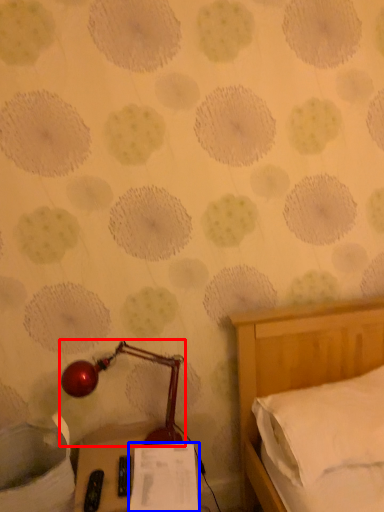
Question: Which of the following is the closest to the observer, lamp (highlighted by a red box) or paper (highlighted by a blue box)?

Choices:
 (A) lamp
 (B) paper

Answer: (B)